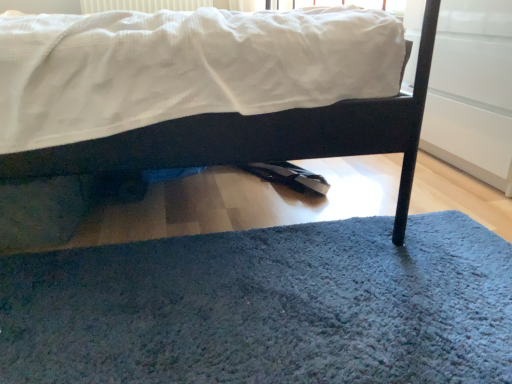
In order to click on matte black bed at center in this screenshot , I will do `click(263, 136)`.

Image resolution: width=512 pixels, height=384 pixels. Describe the element at coordinates (263, 136) in the screenshot. I see `matte black bed at center` at that location.

Describe the element at coordinates (266, 307) in the screenshot. I see `blue shaggy rug at lower center` at that location.

Where is `blue shaggy rug at lower center`? The width and height of the screenshot is (512, 384). blue shaggy rug at lower center is located at coordinates (266, 307).

Identify the location of matte black bed at center. The height and width of the screenshot is (384, 512). (263, 136).

Is blue shaggy rug at lower center at the right side of matte black bed at center?

Yes.

Relative to matte black bed at center, is blue shaggy rug at lower center in front or behind?

Clearly, blue shaggy rug at lower center is in front of matte black bed at center.

Is point (124, 336) closer or farther from the camera than point (371, 128)?

Point (124, 336) is closer to the camera than point (371, 128).

From the image's perspective, is blue shaggy rug at lower center over matte black bed at center?

Actually, blue shaggy rug at lower center appears below matte black bed at center in the image.

From a real-world perspective, is blue shaggy rug at lower center physically located above or below matte black bed at center?

In terms of real-world spatial position, blue shaggy rug at lower center is below matte black bed at center.

Considering the sizes of objects blue shaggy rug at lower center and matte black bed at center in the image provided, who is wider, blue shaggy rug at lower center or matte black bed at center?

Wider between the two is matte black bed at center.

Is blue shaggy rug at lower center shorter than matte black bed at center?

Indeed, blue shaggy rug at lower center has a lesser height compared to matte black bed at center.

Considering the sizes of objects blue shaggy rug at lower center and matte black bed at center in the image provided, who is smaller, blue shaggy rug at lower center or matte black bed at center?

blue shaggy rug at lower center is smaller.

Is blue shaggy rug at lower center located outside matte black bed at center?

Yes.

Can you see blue shaggy rug at lower center touching matte black bed at center?

No, blue shaggy rug at lower center is not in contact with matte black bed at center.

Is blue shaggy rug at lower center positioned with its back to matte black bed at center?

blue shaggy rug at lower center is not turned away from matte black bed at center.

How different are the orientations of blue shaggy rug at lower center and matte black bed at center in degrees?

The facing directions of blue shaggy rug at lower center and matte black bed at center are 89.7 degrees apart.

Measure the distance between blue shaggy rug at lower center and matte black bed at center.

11.81 inches.

In order to click on bed above the blue shaggy rug at lower center (from the image's perspective) in this screenshot , I will do `click(263, 136)`.

Is matte black bed at center to the right of blue shaggy rug at lower center from the viewer's perspective?

Incorrect, matte black bed at center is not on the right side of blue shaggy rug at lower center.

Between matte black bed at center and blue shaggy rug at lower center, which one is positioned behind?

matte black bed at center is further away from the camera.

Which is in front, point (183, 148) or point (262, 258)?

The point (183, 148) is more forward.

From the image's perspective, which one is positioned lower, matte black bed at center or blue shaggy rug at lower center?

blue shaggy rug at lower center.

From a real-world perspective, between matte black bed at center and blue shaggy rug at lower center, who is vertically higher?

matte black bed at center.

Which object is thinner, matte black bed at center or blue shaggy rug at lower center?

blue shaggy rug at lower center is thinner.

Which of these two, matte black bed at center or blue shaggy rug at lower center, stands shorter?

blue shaggy rug at lower center is shorter.

Considering the sizes of objects matte black bed at center and blue shaggy rug at lower center in the image provided, who is bigger, matte black bed at center or blue shaggy rug at lower center?

With larger size is matte black bed at center.

Can we say matte black bed at center lies outside blue shaggy rug at lower center?

That's correct, matte black bed at center is outside of blue shaggy rug at lower center.

Are matte black bed at center and blue shaggy rug at lower center beside each other?

No.

Is matte black bed at center positioned with its back to blue shaggy rug at lower center?

matte black bed at center is not turned away from blue shaggy rug at lower center.

The image size is (512, 384). Identify the location of bed above the blue shaggy rug at lower center (from a real-world perspective). tap(263, 136).

Find the location of `doormat in front of the matte black bed at center`. doormat in front of the matte black bed at center is located at coordinates [x=266, y=307].

Locate an element on the screen. bed positioned vertically above the blue shaggy rug at lower center (from a real-world perspective) is located at coordinates (263, 136).